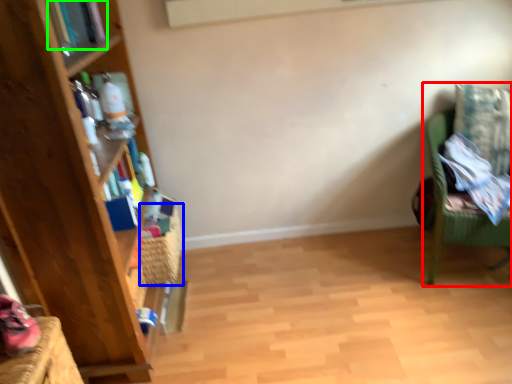
Question: Based on their relative distances, which object is farther from chair (highlighted by a red box)? Choose from basket (highlighted by a blue box) and book (highlighted by a green box).

Choices:
 (A) basket
 (B) book

Answer: (B)